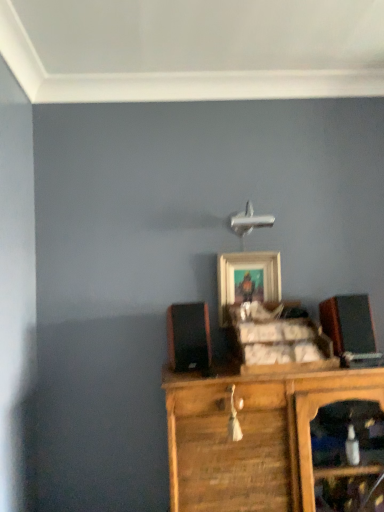
Question: Based on their sizes in the image, would you say black matte speaker at left, acting as the second speaker starting from the right, is bigger or smaller than wooden framed picture at center?

Choices:
 (A) big
 (B) small

Answer: (A)

Question: Is black matte speaker at left, the first speaker in the left-to-right sequence, to the left or to the right of wooden framed picture at center in the image?

Choices:
 (A) left
 (B) right

Answer: (A)

Question: Which of these objects is positioned closest to the black matte speaker at right, which is counted as the 1th speaker, starting from the right?

Choices:
 (A) black matte speaker at left, the first speaker in the left-to-right sequence
 (B) wooden cabinet at center
 (C) wooden framed picture at center

Answer: (C)

Question: Estimate the real-world distances between objects in this image. Which object is farther from the wooden cabinet at center?

Choices:
 (A) black matte speaker at right, which is counted as the second speaker, starting from the left
 (B) black matte speaker at left, acting as the second speaker starting from the right
 (C) wooden framed picture at center

Answer: (C)